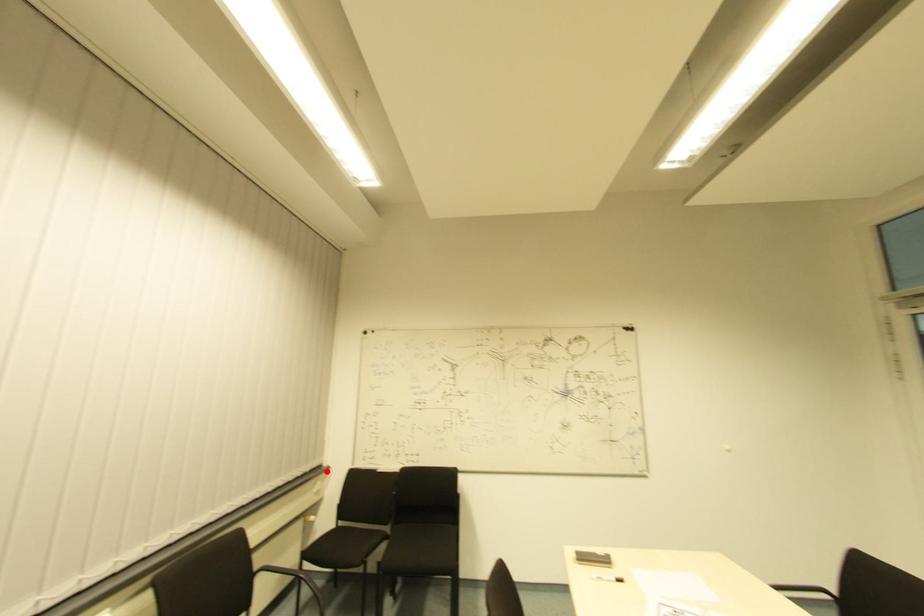
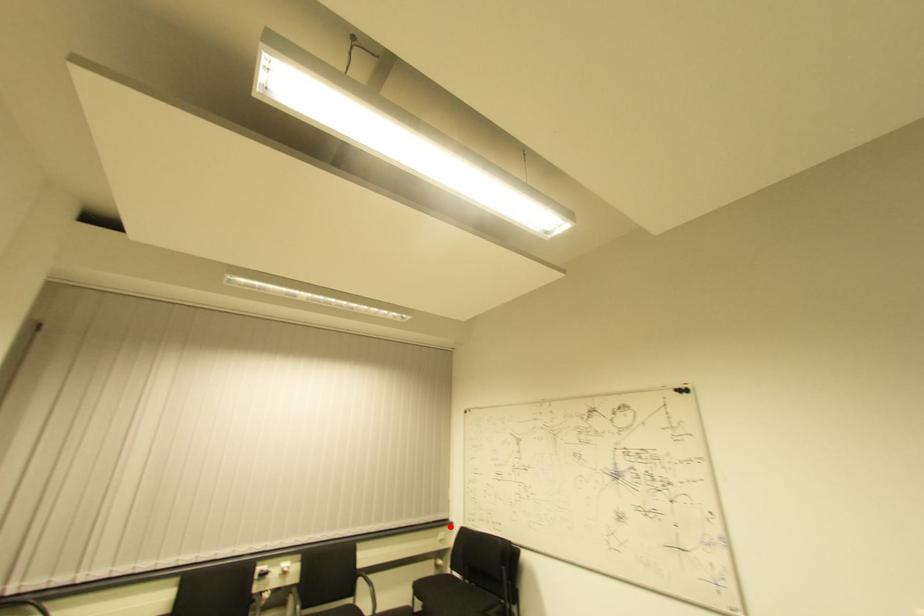
I am providing you with two images of the same scene from different viewpoints. A red point is marked on the first image and another point is marked on the second image. Do the highlighted points in image1 and image2 indicate the same real-world spot?

Yes